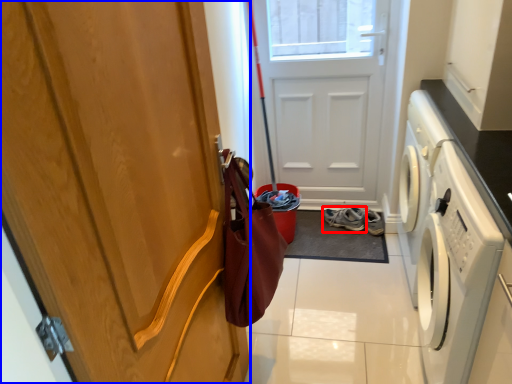
Question: Which object appears farthest to the camera in this image, footwear (highlighted by a red box) or door (highlighted by a blue box)?

Choices:
 (A) footwear
 (B) door

Answer: (A)